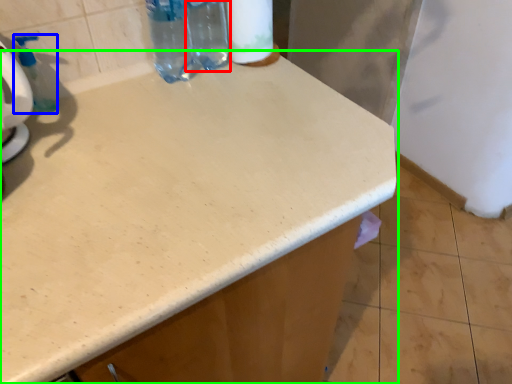
Question: Considering the real-world distances, which object is closest to bottle (highlighted by a red box)? soap dispenser (highlighted by a blue box) or countertop (highlighted by a green box).

Choices:
 (A) soap dispenser
 (B) countertop

Answer: (A)